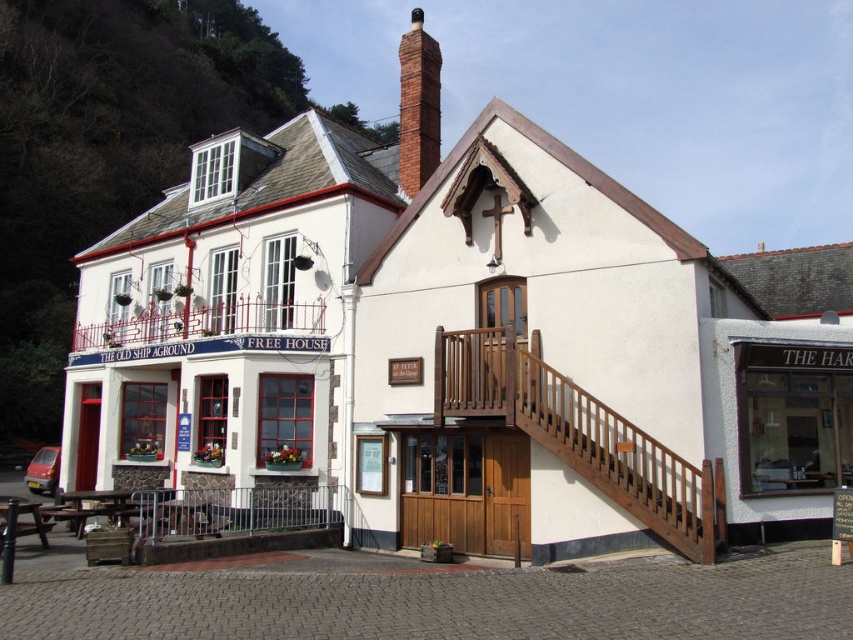
You are planning to install a new sign for the pub. The sign is 10 meters wide. Can you determine if the white painted wood pub at left has enough space to accommodate the sign based on its width compared to the red brick chimney at upper center?

The white painted wood pub at left might be wider than the red brick chimney at upper center, but since the sign is 10 meters wide, we need to know the exact width of the pub to determine if it can accommodate the sign. The current information is uncertain.

You are a painter who needs to decide which object to paint first between the wooden stairs at center and the red brick chimney at upper center. Since you want to work on the narrower one first, which object should you choose?

The wooden stairs at center has a lesser width compared to the red brick chimney at upper center, so you should paint the wooden stairs at center first.

You are standing at the entrance of The Old Ship Aground pub. You want to go up to the second floor but need to know if your 1.8 meters tall friend can safely walk up the wooden stairs at center without hitting their head. Can you determine if there is enough headroom?

The wooden stairs at center are 29.31 meters away from the camera. However, the description provided does not mention the height of the stairs or the ceiling clearance. Therefore, it is impossible to determine if there is enough headroom for your friend.